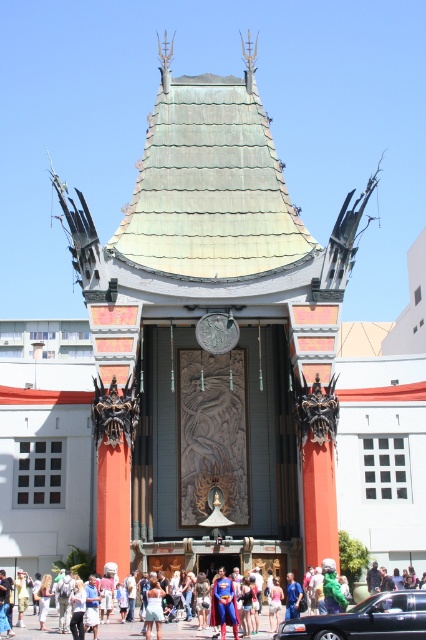
Question: Does shiny black sedan at center have a smaller size compared to blue fabric superhero costume at center?

Choices:
 (A) yes
 (B) no

Answer: (B)

Question: Which point appears closest to the camera in this image?

Choices:
 (A) click(x=222, y=616)
 (B) click(x=342, y=634)
 (C) click(x=359, y=630)

Answer: (C)

Question: From the image, what is the correct spatial relationship of green tile roof at center in relation to denim shorts at center?

Choices:
 (A) right
 (B) left

Answer: (A)

Question: Based on their relative distances, which object is nearer to the blue fabric superhero costume at center?

Choices:
 (A) shiny black sedan at center
 (B) denim shorts at center

Answer: (B)

Question: Which point appears closest to the camera in this image?

Choices:
 (A) (351, 621)
 (B) (199, 301)
 (C) (417, 625)
 (D) (155, 577)

Answer: (C)

Question: Does superman costume at center appear on the left side of blue fabric superhero costume at center?

Choices:
 (A) yes
 (B) no

Answer: (B)